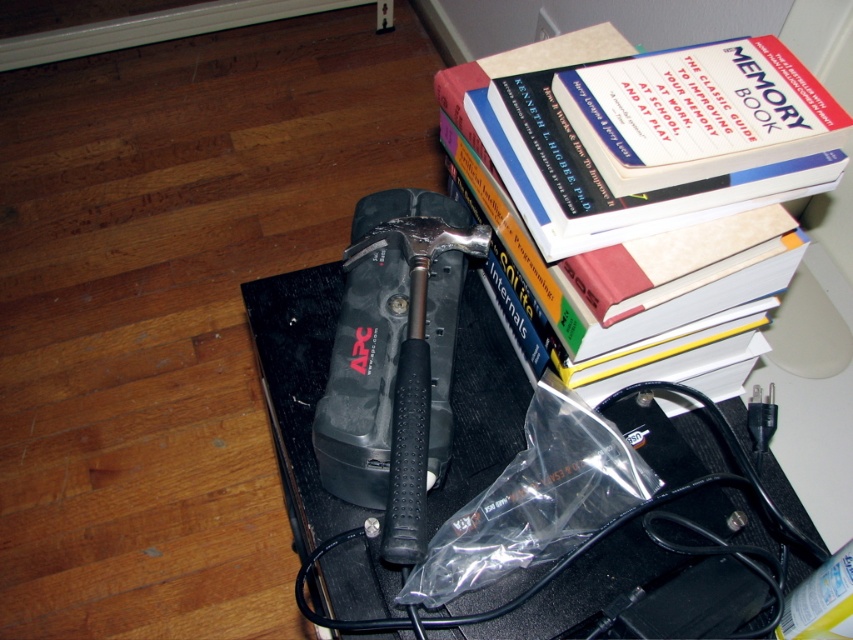
Question: Does black rubberized hammer at center lie in front of hardcover book at upper right?

Choices:
 (A) yes
 (B) no

Answer: (A)

Question: Is black rubberized hammer at center thinner than hardcover book at upper right?

Choices:
 (A) no
 (B) yes

Answer: (B)

Question: Which of these objects is positioned farthest from the hardcover book at upper right?

Choices:
 (A) black rubberized hammer at center
 (B) black plastic table at center

Answer: (B)

Question: Which of the following is the farthest from the observer?

Choices:
 (A) (439, 496)
 (B) (468, 163)
 (C) (318, 452)

Answer: (B)

Question: Does black plastic table at center lie behind hardcover book at upper right?

Choices:
 (A) no
 (B) yes

Answer: (B)

Question: Which point appears closest to the camera in this image?

Choices:
 (A) (248, 312)
 (B) (735, 236)

Answer: (B)